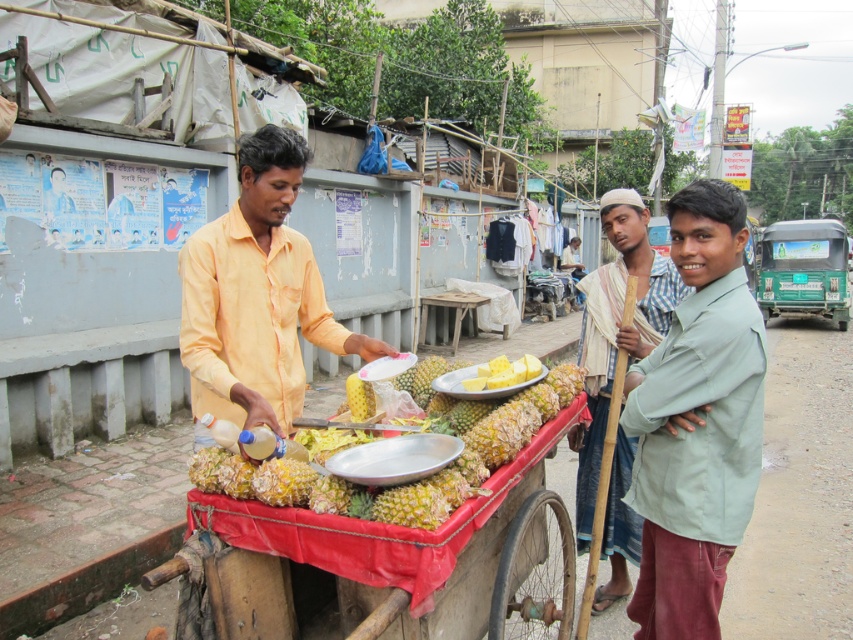
Question: Can you confirm if yellow cotton shirt at center is positioned to the left of light green fabric shirt at right?

Choices:
 (A) no
 (B) yes

Answer: (B)

Question: Which object is farther from the camera taking this photo?

Choices:
 (A) light green fabric shirt at right
 (B) yellow cotton shirt at center

Answer: (A)

Question: Can you confirm if light green fabric shirt at center is thinner than yellow cotton shirt at center?

Choices:
 (A) yes
 (B) no

Answer: (A)

Question: Which point is farther to the camera?

Choices:
 (A) light green fabric shirt at center
 (B) wooden cart at center

Answer: (A)

Question: Can you confirm if light green fabric shirt at center is positioned to the right of yellow cotton shirt at center?

Choices:
 (A) yes
 (B) no

Answer: (A)

Question: Which point is farther from the camera taking this photo?

Choices:
 (A) (695, 436)
 (B) (634, 198)
 (C) (357, 385)

Answer: (B)